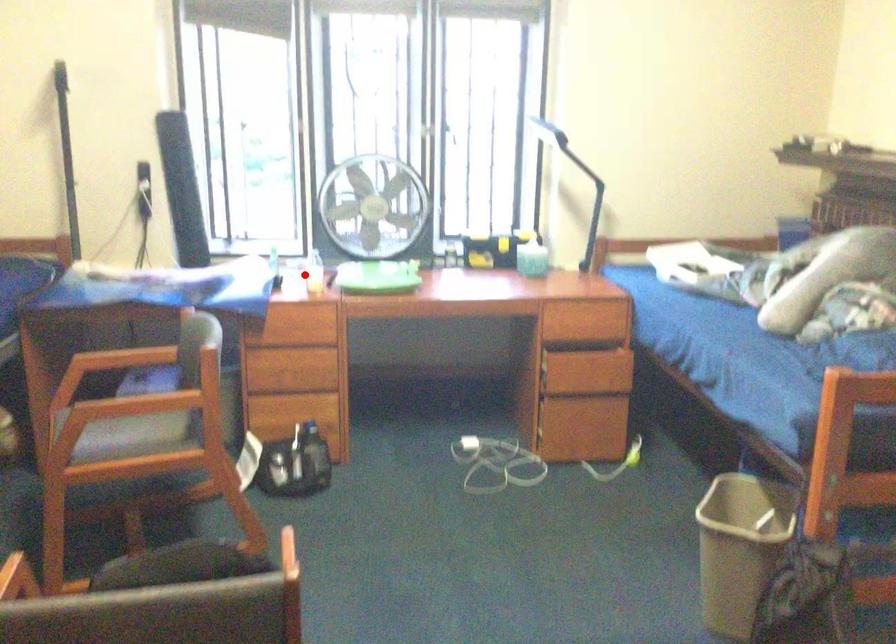
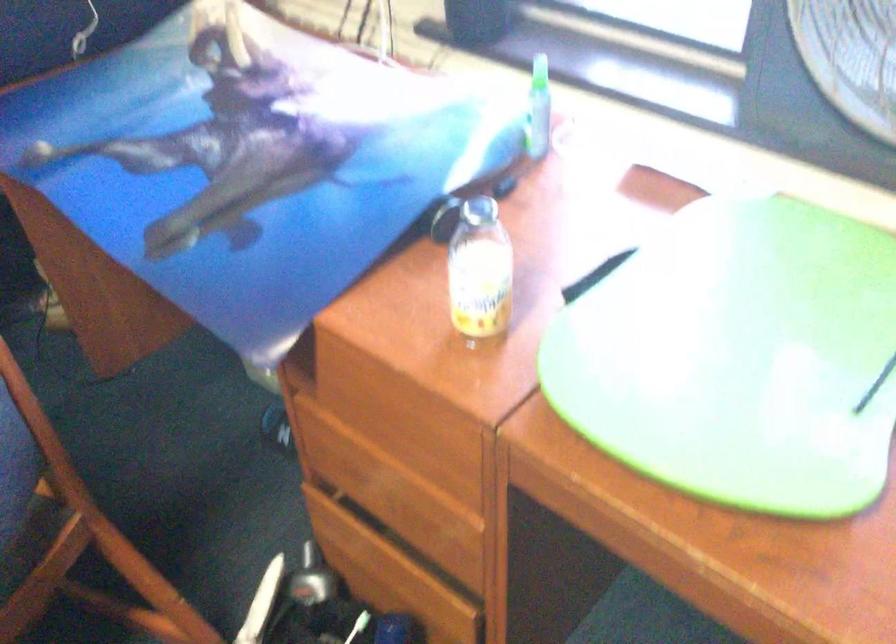
In the second image, find the point that corresponds to the highlighted location in the first image.

(479, 270)